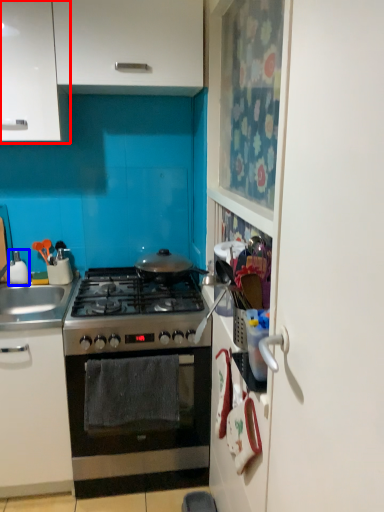
Question: Which of the following is the closest to the observer, cabinetry (highlighted by a red box) or appliance (highlighted by a blue box)?

Choices:
 (A) cabinetry
 (B) appliance

Answer: (A)